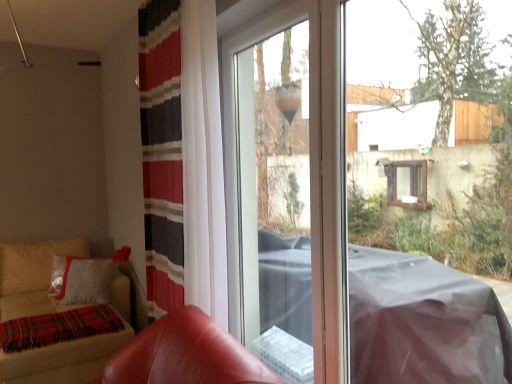
Question: Does velvet beige sofa at lower left come in front of transparent plastic screen door at center?

Choices:
 (A) no
 (B) yes

Answer: (A)

Question: From the image's perspective, would you say velvet beige sofa at lower left is shown under transparent plastic screen door at center?

Choices:
 (A) no
 (B) yes

Answer: (B)

Question: Can you confirm if velvet beige sofa at lower left is taller than transparent plastic screen door at center?

Choices:
 (A) yes
 (B) no

Answer: (B)

Question: Is velvet beige sofa at lower left facing away from transparent plastic screen door at center?

Choices:
 (A) yes
 (B) no

Answer: (B)

Question: Does velvet beige sofa at lower left appear on the left side of transparent plastic screen door at center?

Choices:
 (A) yes
 (B) no

Answer: (A)

Question: Is plaid woolen blanket at lower left wider or thinner than leather armchair at lower left?

Choices:
 (A) wide
 (B) thin

Answer: (B)

Question: Is point (94, 332) positioned closer to the camera than point (179, 311)?

Choices:
 (A) farther
 (B) closer

Answer: (A)

Question: Do you think plaid woolen blanket at lower left is within leather armchair at lower left, or outside of it?

Choices:
 (A) inside
 (B) outside

Answer: (B)

Question: Looking at the image, does plaid woolen blanket at lower left seem bigger or smaller compared to leather armchair at lower left?

Choices:
 (A) big
 (B) small

Answer: (B)

Question: In the image, is velvet beige sofa at lower left positioned in front of or behind plaid woolen blanket at lower left?

Choices:
 (A) front
 (B) behind

Answer: (A)

Question: Is velvet beige sofa at lower left bigger or smaller than plaid woolen blanket at lower left?

Choices:
 (A) big
 (B) small

Answer: (A)

Question: Is velvet beige sofa at lower left wider or thinner than plaid woolen blanket at lower left?

Choices:
 (A) thin
 (B) wide

Answer: (B)

Question: Based on their positions, is velvet beige sofa at lower left located to the left or right of plaid woolen blanket at lower left?

Choices:
 (A) left
 (B) right

Answer: (A)

Question: From their relative heights in the image, would you say plaid woolen blanket at lower left is taller or shorter than transparent plastic screen door at center?

Choices:
 (A) short
 (B) tall

Answer: (A)

Question: From the image's perspective, is plaid woolen blanket at lower left positioned above or below transparent plastic screen door at center?

Choices:
 (A) below
 (B) above

Answer: (A)